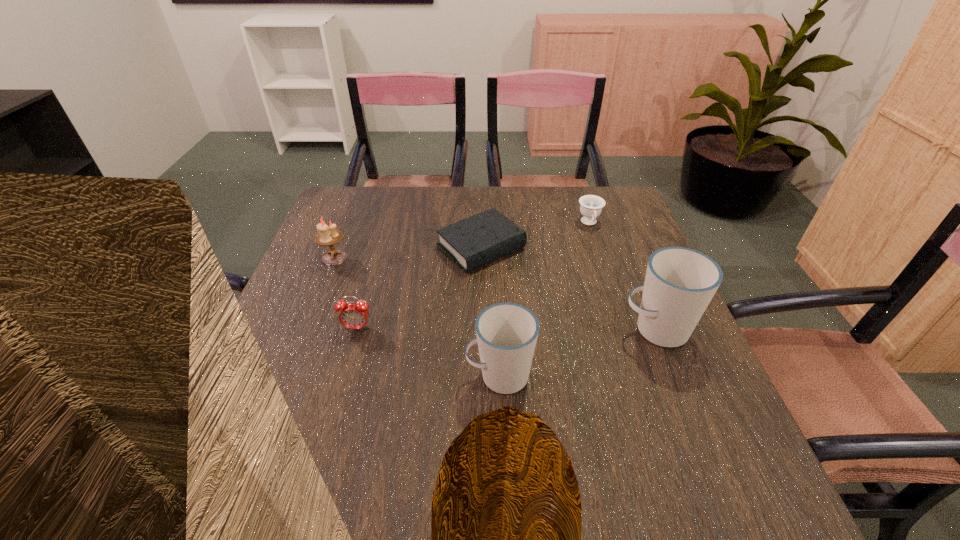
Point out which object is positioned as the third nearest to the alarm clock. Please provide its 2D coordinates. Your answer should be formatted as a tuple, i.e. [(x, y)], where the tuple contains the x and y coordinates of a point satisfying the conditions above.

[(507, 333)]